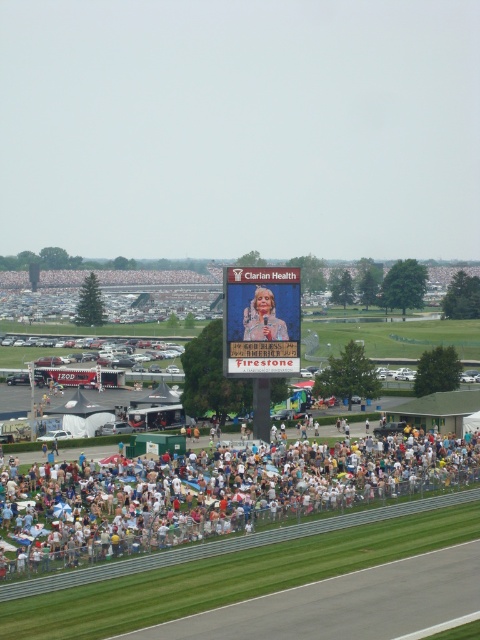
You are a photographer at the event and want to capture a photo of both the matte black person at lower center and the matte pink dress at center. Which object should you focus on first to ensure both are in frame?

The matte black person at lower center is shorter than the matte pink dress at center, so you should focus on the matte pink dress at center first to ensure both are in frame.